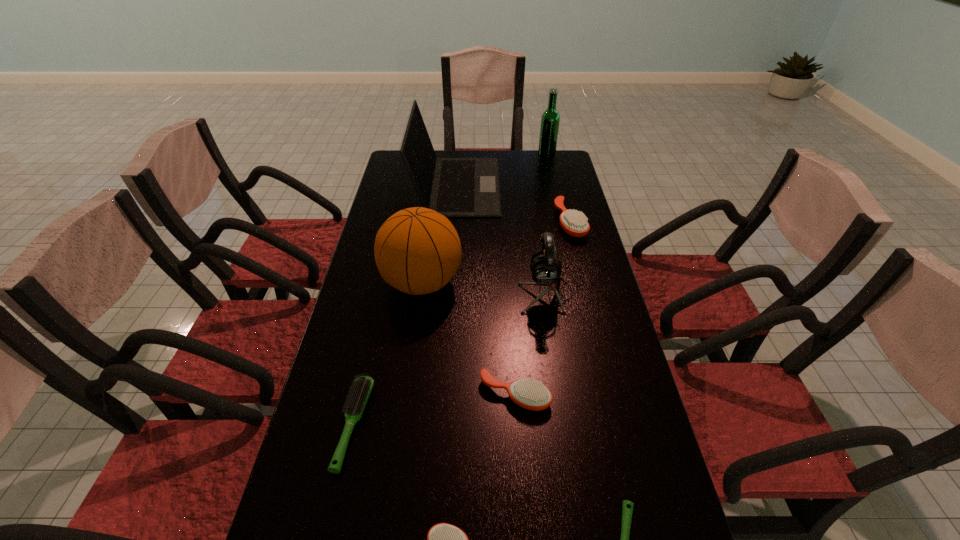
Where is `orange hairbrush object that ranks as the closest to the earphone`? The height and width of the screenshot is (540, 960). orange hairbrush object that ranks as the closest to the earphone is located at coordinates (574, 223).

Locate an element on the screen. light hairbrush that can be found as the closest to the laptop is located at coordinates (361, 389).

Identify which light hairbrush is the closest to the sixth tallest object. Please provide its 2D coordinates. Your answer should be formatted as a tuple, i.e. [(x, y)], where the tuple contains the x and y coordinates of a point satisfying the conditions above.

[(627, 507)]

Identify the location of vacant space that satisfies the following two spatial constraints: 1. on the screen of the laptop; 2. on the right side of the second nearest orange hairbrush. (x=442, y=395).